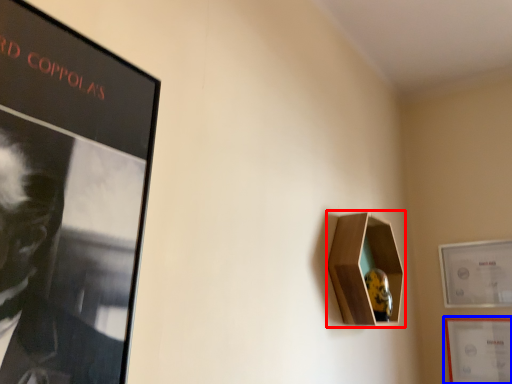
Question: Among these objects, which one is farthest to the camera, cabinet (highlighted by a red box) or picture frame (highlighted by a blue box)?

Choices:
 (A) cabinet
 (B) picture frame

Answer: (B)